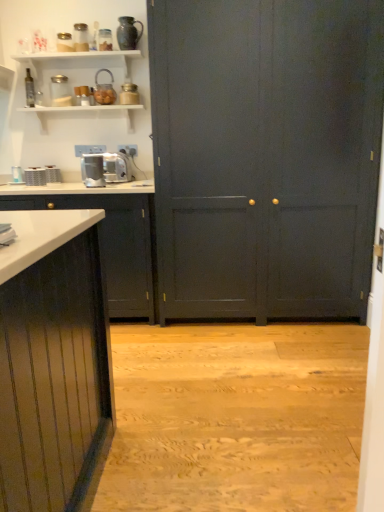
Question: Is clear glass jar at upper left, the 4th appliance from the right, inside or outside of matte glass teapot at upper center, which appears as the third appliance when viewed from the right?

Choices:
 (A) outside
 (B) inside

Answer: (A)

Question: From their relative heights in the image, would you say clear glass jar at upper left, the 4th appliance from the right, is taller or shorter than matte glass teapot at upper center, the fifth appliance positioned from the left?

Choices:
 (A) tall
 (B) short

Answer: (B)

Question: Estimate the real-world distances between objects in this image. Which object is farther from the metallic silver toaster at upper center, which ranks as the 1th appliance in right-to-left order?

Choices:
 (A) metallic silver toaster at left, arranged as the 5th appliance when viewed from the right
 (B) matte dark gray cupboard at center
 (C) brushed metal toaster at left, the 7th appliance when ordered from right to left
 (D) satin silver toaster at center, which ranks as the 2th appliance in right-to-left order
 (E) brushed metal toaster at left, which is the sixth appliance in right-to-left order

Answer: (B)

Question: Based on their relative distances, which object is nearer to the matte glass teapot at upper center, the fifth appliance positioned from the left?

Choices:
 (A) clear glass jar at upper left, the 4th appliance from the right
 (B) brushed metal toaster at left, which is the sixth appliance in right-to-left order
 (C) satin silver toaster at center, which ranks as the 2th appliance in right-to-left order
 (D) matte dark gray cupboard at center
 (E) metallic silver toaster at upper center, which ranks as the 1th appliance in right-to-left order

Answer: (E)